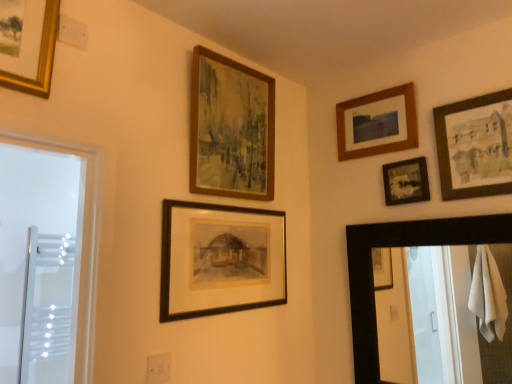
Question: Would you say wooden-framed painting at upper center, which appears as the 2th picture frame when viewed from the left, is outside transparent glass screen door at left?

Choices:
 (A) no
 (B) yes

Answer: (B)

Question: Is wooden-framed painting at upper center, the 4th picture frame when ordered from right to left, aimed at transparent glass screen door at left?

Choices:
 (A) no
 (B) yes

Answer: (A)

Question: Can you confirm if wooden-framed painting at upper center, which appears as the 2th picture frame when viewed from the left, is shorter than transparent glass screen door at left?

Choices:
 (A) yes
 (B) no

Answer: (A)

Question: Could transparent glass screen door at left be considered to be inside wooden-framed painting at upper center, the 4th picture frame when ordered from right to left?

Choices:
 (A) yes
 (B) no

Answer: (B)

Question: From the image's perspective, is wooden-framed painting at upper center, which appears as the 2th picture frame when viewed from the left, beneath transparent glass screen door at left?

Choices:
 (A) no
 (B) yes

Answer: (A)

Question: Based on their sizes in the image, would you say transparent glass screen door at left is bigger or smaller than wooden frame at upper right, marked as the 3th picture frame in a left-to-right arrangement?

Choices:
 (A) big
 (B) small

Answer: (A)

Question: From a real-world perspective, is transparent glass screen door at left positioned above or below wooden frame at upper right, marked as the 3th picture frame in a left-to-right arrangement?

Choices:
 (A) below
 (B) above

Answer: (A)

Question: Is transparent glass screen door at left wider or thinner than wooden frame at upper right, arranged as the 3th picture frame when viewed from the right?

Choices:
 (A) wide
 (B) thin

Answer: (A)

Question: In the image, is transparent glass screen door at left positioned in front of or behind wooden frame at upper right, arranged as the 3th picture frame when viewed from the right?

Choices:
 (A) front
 (B) behind

Answer: (B)

Question: From the image's perspective, is wooden framed painting at upper right, which ranks as the 1th picture frame in right-to-left order, positioned above or below black wooden mirror at right?

Choices:
 (A) above
 (B) below

Answer: (A)

Question: Considering the positions of wooden framed painting at upper right, marked as the fifth picture frame in a left-to-right arrangement, and black wooden mirror at right in the image, is wooden framed painting at upper right, marked as the fifth picture frame in a left-to-right arrangement, taller or shorter than black wooden mirror at right?

Choices:
 (A) short
 (B) tall

Answer: (A)

Question: Would you say wooden framed painting at upper right, which ranks as the 1th picture frame in right-to-left order, is to the left or to the right of black wooden mirror at right in the picture?

Choices:
 (A) right
 (B) left

Answer: (A)

Question: Choose the correct answer: Is wooden framed painting at upper right, marked as the fifth picture frame in a left-to-right arrangement, inside black wooden mirror at right or outside it?

Choices:
 (A) inside
 (B) outside

Answer: (B)

Question: Is transparent glass screen door at left in front of or behind matte black picture frame at center, the fifth picture frame when ordered from right to left, in the image?

Choices:
 (A) front
 (B) behind

Answer: (B)

Question: From a real-world perspective, is transparent glass screen door at left positioned above or below matte black picture frame at center, the 1th picture frame viewed from the left?

Choices:
 (A) below
 (B) above

Answer: (A)